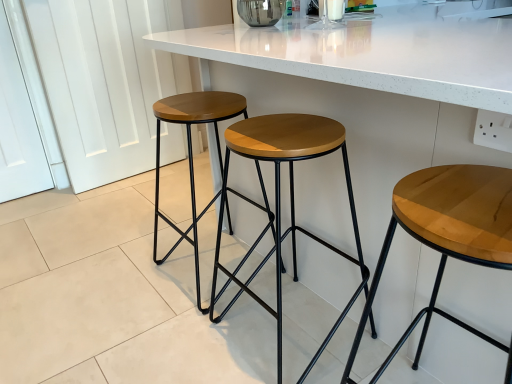
Question: Is wooden/matte stool at center, which is the third stool from right to left, surrounded by woodenmaterial/texturestool at center, the 2th stool when ordered from left to right?

Choices:
 (A) no
 (B) yes

Answer: (A)

Question: Is woodenmaterial/texturestool at center, the 2th stool when ordered from left to right, located outside wooden/matte stool at center, the first stool when ordered from left to right?

Choices:
 (A) no
 (B) yes

Answer: (B)

Question: Does woodenmaterial/texturestool at center, the 2th stool when ordered from left to right, come in front of wooden/matte stool at center, the first stool when ordered from left to right?

Choices:
 (A) no
 (B) yes

Answer: (B)

Question: Can you confirm if woodenmaterial/texturestool at center, the 2th stool when ordered from left to right, is bigger than wooden/matte stool at center, the first stool when ordered from left to right?

Choices:
 (A) yes
 (B) no

Answer: (B)

Question: Are woodenmaterial/texturestool at center, positioned as the second stool in right-to-left order, and wooden/matte stool at center, the first stool when ordered from left to right, far apart?

Choices:
 (A) no
 (B) yes

Answer: (A)

Question: Is woodenmaterial/texturestool at center, the 2th stool when ordered from left to right, facing towards wooden/matte stool at center, which is the third stool from right to left?

Choices:
 (A) no
 (B) yes

Answer: (A)

Question: From a real-world perspective, is white marble countertop at center positioned under wooden/matte stool at center, the first stool when ordered from left to right, based on gravity?

Choices:
 (A) yes
 (B) no

Answer: (B)

Question: Considering the relative sizes of white marble countertop at center and wooden/matte stool at center, the first stool when ordered from left to right, in the image provided, is white marble countertop at center smaller than wooden/matte stool at center, the first stool when ordered from left to right,?

Choices:
 (A) no
 (B) yes

Answer: (A)

Question: Is white marble countertop at center closer to camera compared to wooden/matte stool at center, which is the third stool from right to left?

Choices:
 (A) yes
 (B) no

Answer: (A)

Question: Would you say white marble countertop at center contains wooden/matte stool at center, the first stool when ordered from left to right?

Choices:
 (A) yes
 (B) no

Answer: (A)

Question: Does white marble countertop at center have a greater width compared to wooden/matte stool at center, which is the third stool from right to left?

Choices:
 (A) yes
 (B) no

Answer: (A)

Question: Can you confirm if white marble countertop at center is positioned to the left of wooden/matte stool at center, the first stool when ordered from left to right?

Choices:
 (A) yes
 (B) no

Answer: (B)

Question: Can you confirm if woodenmaterial/texturestool at center, the 2th stool when ordered from left to right, is taller than white marble countertop at center?

Choices:
 (A) no
 (B) yes

Answer: (A)